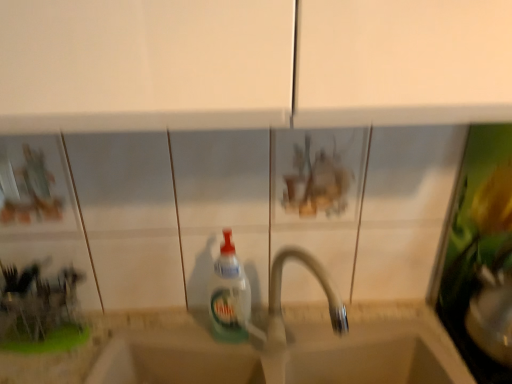
Question: Is beige stone sink at center taller than white plastic tap at center?

Choices:
 (A) yes
 (B) no

Answer: (B)

Question: Is beige stone sink at center to the left of white plastic tap at center from the viewer's perspective?

Choices:
 (A) no
 (B) yes

Answer: (B)

Question: Is white plastic tap at center inside beige stone sink at center?

Choices:
 (A) yes
 (B) no

Answer: (B)

Question: Considering the relative sizes of beige stone sink at center and white plastic tap at center in the image provided, is beige stone sink at center thinner than white plastic tap at center?

Choices:
 (A) no
 (B) yes

Answer: (B)

Question: From the image's perspective, is beige stone sink at center located beneath white plastic tap at center?

Choices:
 (A) yes
 (B) no

Answer: (A)

Question: From a real-world perspective, is beige stone sink at center on white plastic tap at center?

Choices:
 (A) no
 (B) yes

Answer: (A)

Question: Is the position of white plastic tap at center more distant than that of translucent plastic bottle at center?

Choices:
 (A) no
 (B) yes

Answer: (A)

Question: Can you confirm if white plastic tap at center is wider than translucent plastic bottle at center?

Choices:
 (A) no
 (B) yes

Answer: (B)

Question: Is white plastic tap at center positioned far away from translucent plastic bottle at center?

Choices:
 (A) no
 (B) yes

Answer: (A)

Question: Can you confirm if white plastic tap at center is smaller than translucent plastic bottle at center?

Choices:
 (A) no
 (B) yes

Answer: (A)

Question: From a real-world perspective, does white plastic tap at center sit lower than translucent plastic bottle at center?

Choices:
 (A) no
 (B) yes

Answer: (A)

Question: Considering the relative sizes of white plastic tap at center and translucent plastic bottle at center in the image provided, is white plastic tap at center taller than translucent plastic bottle at center?

Choices:
 (A) yes
 (B) no

Answer: (A)

Question: Is beige stone sink at center smaller than translucent plastic bottle at center?

Choices:
 (A) no
 (B) yes

Answer: (A)